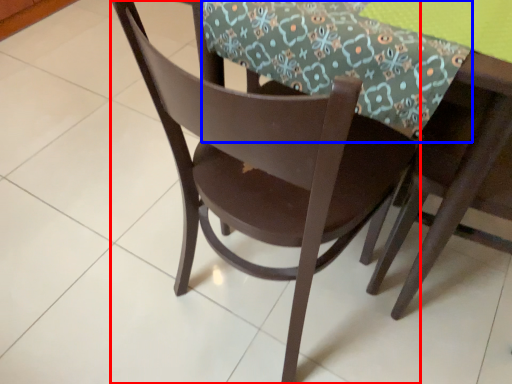
Question: Which point is further to the camera, chair (highlighted by a red box) or tablecloth (highlighted by a blue box)?

Choices:
 (A) chair
 (B) tablecloth

Answer: (B)